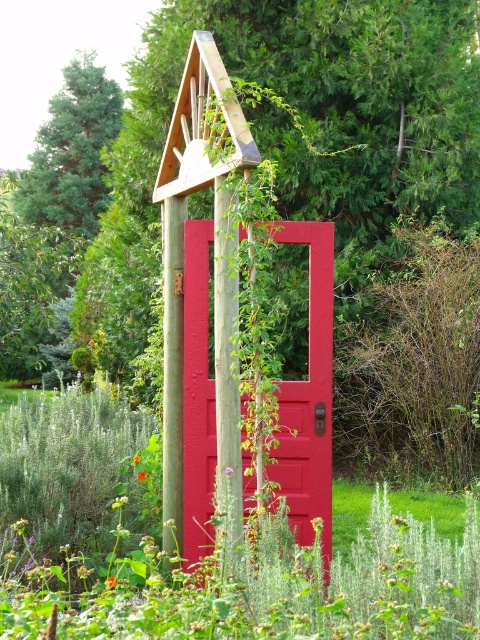
You are a painter who needs to decide whether to paint the matte wooden door at center or the wooden post at center first. Since you want to paint the taller object first to avoid dripping paint on the shorter one, which should you paint first?

The wooden post at center is taller than the matte wooden door at center, so you should paint the wooden post at center first to avoid dripping paint on the shorter matte wooden door at center.

In the scene shown: You are a gardener trying to hang a small bird feeder. You have two options to attach it to the structure shown in the image. You can either hang it from the matte wooden door at center or the wooden post at center. Based on their positions, which object would be a better choice for hanging the bird feeder?

The wooden post at center is a better choice for hanging the bird feeder because the matte wooden door at center is positioned under it, meaning the post is higher up and more suitable for supporting the feeder.